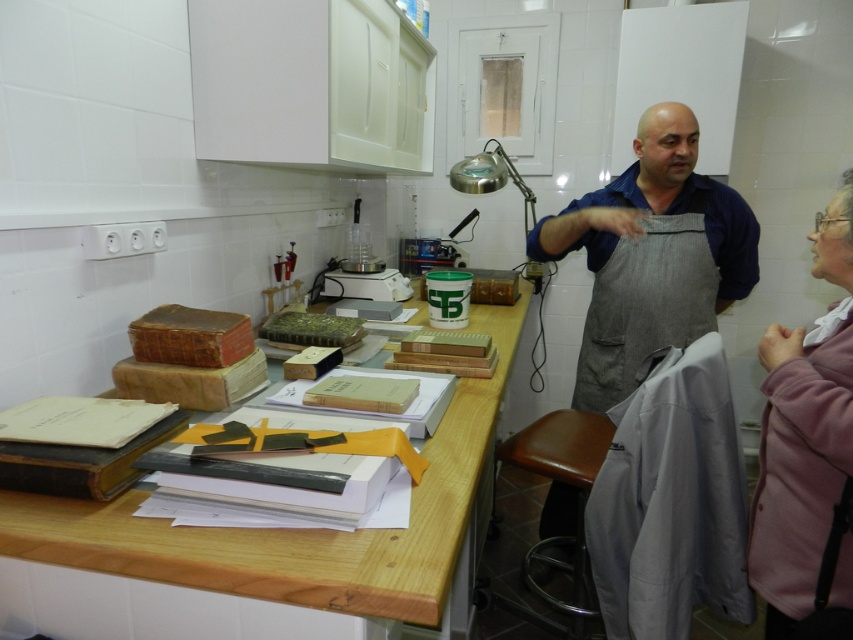
You are standing in the laboratory and need to place a new equipment on the wooden table at center. Where exactly should you place it?

The wooden table at center is located at point (254,545), so place the equipment there.

Based on the photo, you are organizing a science fair and need to place a gray cotton apron at center and a brown leather stool at lower center on a table. If the table is only 1 meter wide, will both items fit side by side?

The gray cotton apron at center is wider than the brown leather stool at lower center. However, without knowing their exact widths, it is impossible to determine if both will fit on a 1 meter wide table. More information about their individual dimensions is required.

You are an assistant in the laboratory and need to place a small tool on a flat surface. Which object between the gray cotton apron at center and the brown leather stool at lower center is taller and can provide a stable surface?

The brown leather stool at lower center is taller than the gray cotton apron at center, so it can provide a stable surface for placing the small tool.